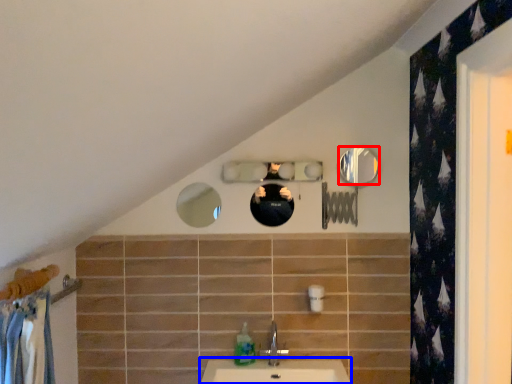
Question: Which of the following is the farthest to the observer, mirror (highlighted by a red box) or counter top (highlighted by a blue box)?

Choices:
 (A) mirror
 (B) counter top

Answer: (A)